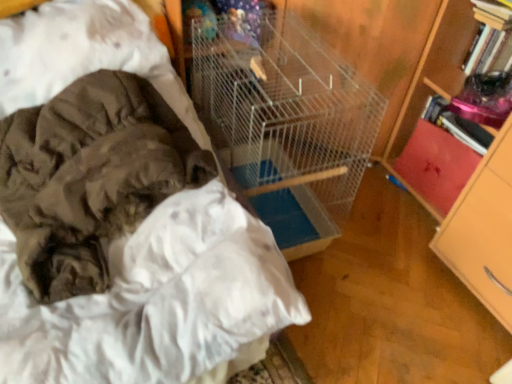
Image resolution: width=512 pixels, height=384 pixels. I want to click on free spot above white wire birdcage at center (from a real-world perspective), so click(x=291, y=64).